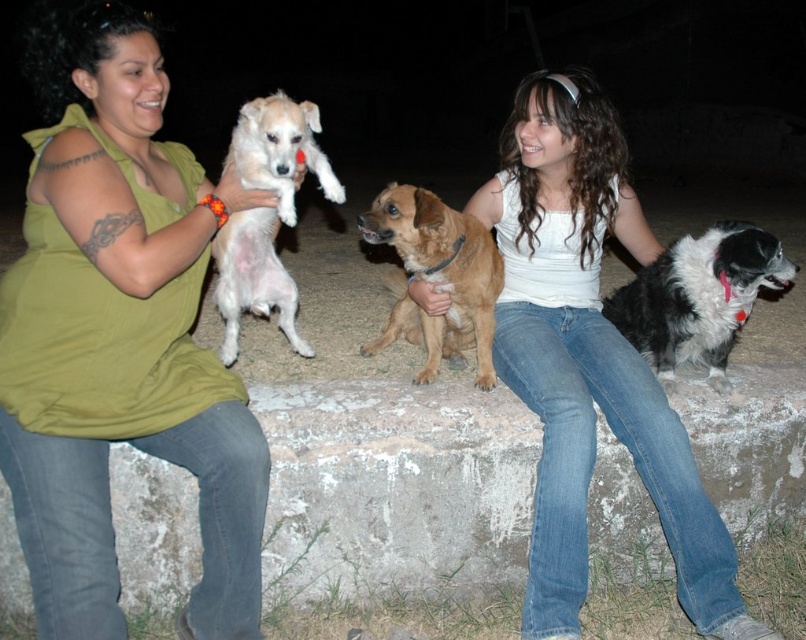
Is black and white fluffy dog at lower right closer to camera compared to brown furry dog at center?

That is False.

Between point (688, 349) and point (408, 252), which one is positioned in front?

Point (408, 252) is in front.

Where is `black and white fluffy dog at lower right`? This screenshot has height=640, width=806. black and white fluffy dog at lower right is located at coordinates (698, 298).

Based on the photo, does white cotton tank top at center appear over brown furry dog at center?

No, white cotton tank top at center is not above brown furry dog at center.

Based on the photo, is white cotton tank top at center wider than brown furry dog at center?

Yes, white cotton tank top at center is wider than brown furry dog at center.

Is point (622, 140) closer to camera compared to point (489, 241)?

No, (622, 140) is behind (489, 241).

You are a GUI agent. You are given a task and a screenshot of the screen. Output one action in this format:
    pyautogui.click(x=<x>, y=<y>)
    Task: Click on the white cotton tank top at center
    Image resolution: width=806 pixels, height=640 pixels.
    Given the screenshot: What is the action you would take?
    pyautogui.click(x=588, y=356)

Between black and white fluffy dog at lower right and white fluffy dog at upper left, which one has more height?

white fluffy dog at upper left

The height and width of the screenshot is (640, 806). Describe the element at coordinates (698, 298) in the screenshot. I see `black and white fluffy dog at lower right` at that location.

Identify the location of black and white fluffy dog at lower right. The width and height of the screenshot is (806, 640). (698, 298).